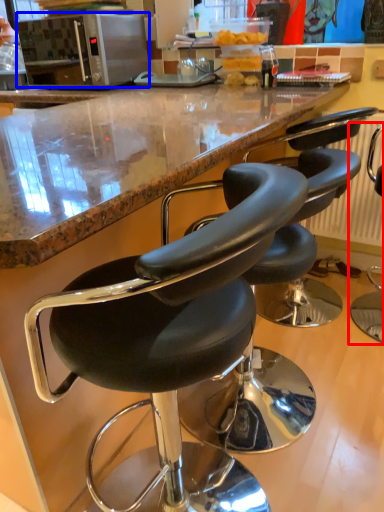
Question: Which object is closer to the camera taking this photo, chair (highlighted by a red box) or microwave oven (highlighted by a blue box)?

Choices:
 (A) chair
 (B) microwave oven

Answer: (A)